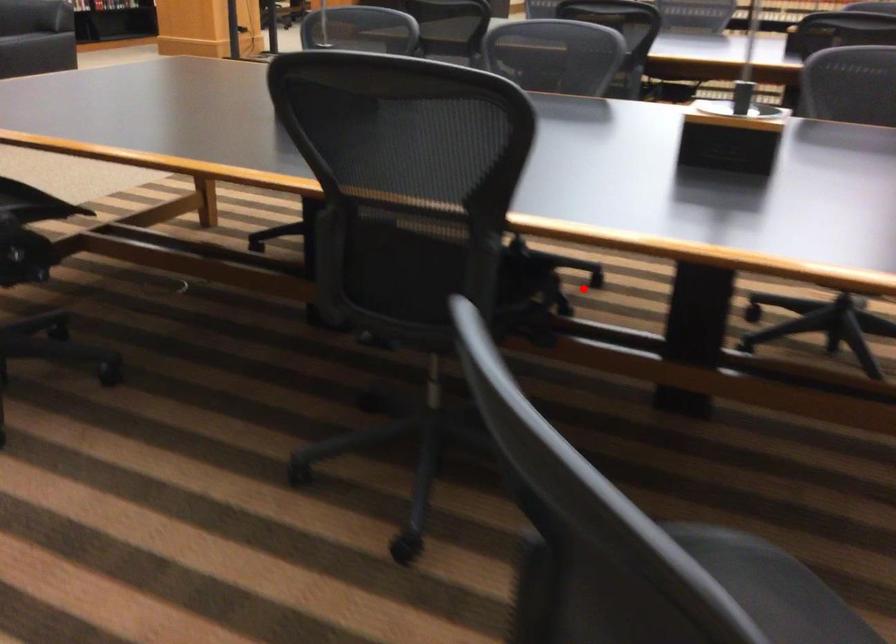
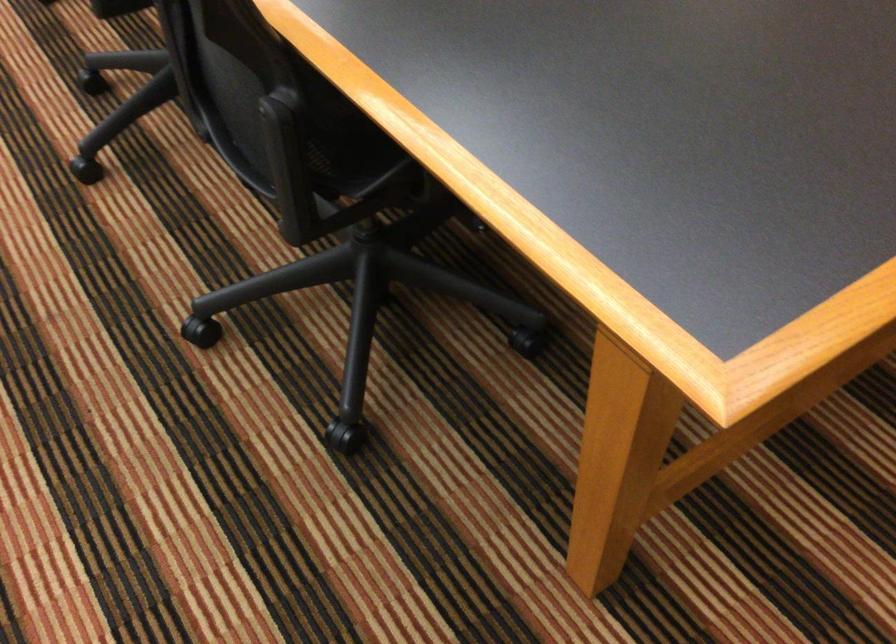
Question: I am providing you with two images of the same scene from different viewpoints. In image1, a red point is highlighted. Considering the same 3D point in image2, which of the following is correct?

Choices:
 (A) It is closer
 (B) It is farther

Answer: (A)